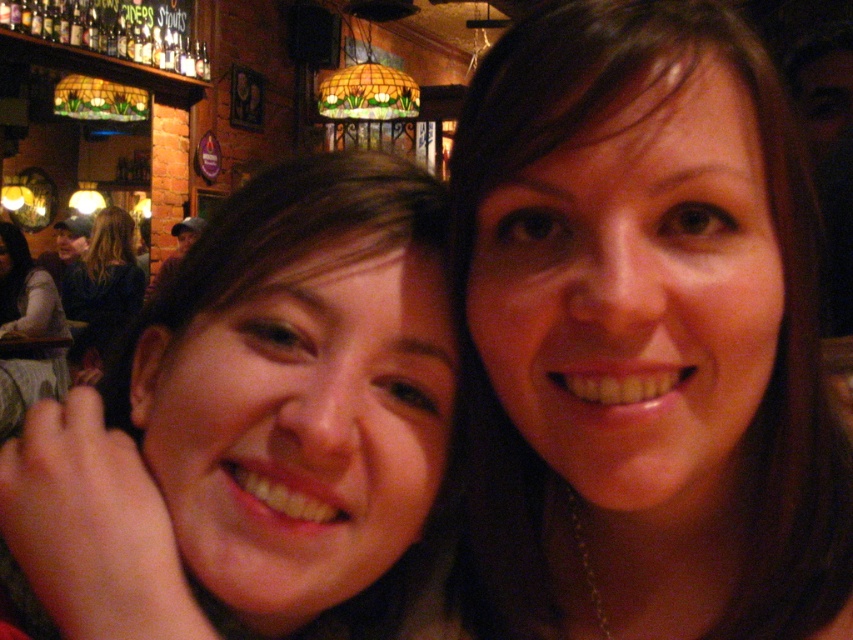
In the scene shown: Can you confirm if brown hair at center is positioned to the left of dark brown hair at left?

In fact, brown hair at center is to the right of dark brown hair at left.

Who is lower down, brown hair at center or dark brown hair at left?

Positioned lower is brown hair at center.

The height and width of the screenshot is (640, 853). Describe the element at coordinates (645, 333) in the screenshot. I see `brown hair at center` at that location.

At what (x,y) coordinates should I click in order to perform the action: click on brown hair at center. Please return your answer as a coordinate pair (x, y). This screenshot has width=853, height=640. Looking at the image, I should click on (645, 333).

Is smooth skin face at center closer to the viewer compared to dark brown hair at left?

Yes.

Between smooth skin face at center and dark brown hair at left, which one has less height?

smooth skin face at center

What do you see at coordinates (297, 392) in the screenshot? I see `smooth skin face at center` at bounding box center [297, 392].

What are the coordinates of `smooth skin face at center` in the screenshot? It's located at (297, 392).

Can you confirm if brown hair at center is positioned to the left of smooth skin face at center?

Incorrect, brown hair at center is not on the left side of smooth skin face at center.

Is brown hair at center below smooth skin face at center?

Actually, brown hair at center is above smooth skin face at center.

I want to click on brown hair at center, so click(645, 333).

At what (x,y) coordinates should I click in order to perform the action: click on brown hair at center. Please return your answer as a coordinate pair (x, y). Image resolution: width=853 pixels, height=640 pixels. Looking at the image, I should click on (645, 333).